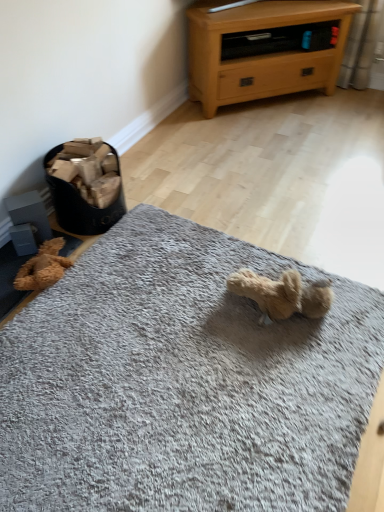
Where is `vacant area situated below gray soft rug at center (from a real-world perspective)`? The height and width of the screenshot is (512, 384). vacant area situated below gray soft rug at center (from a real-world perspective) is located at coordinates (203, 412).